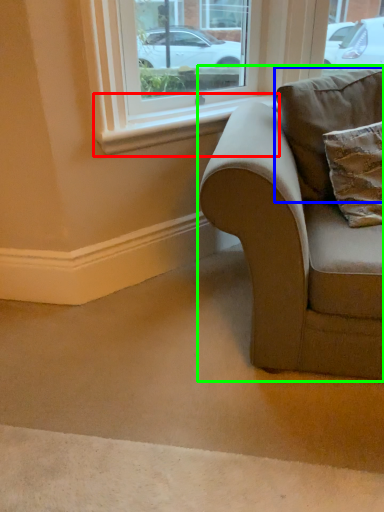
Question: Based on their relative distances, which object is nearer to window sill (highlighted by a red box)? Choose from pillow (highlighted by a blue box) and studio couch (highlighted by a green box).

Choices:
 (A) pillow
 (B) studio couch

Answer: (A)